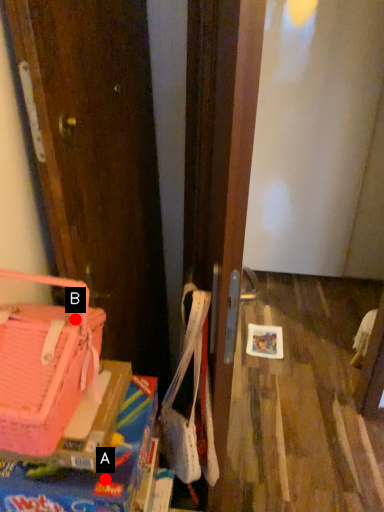
Question: Two points are circled on the image, labeled by A and B beside each circle. Which point is closer to the camera?

Choices:
 (A) A is closer
 (B) B is closer

Answer: (A)